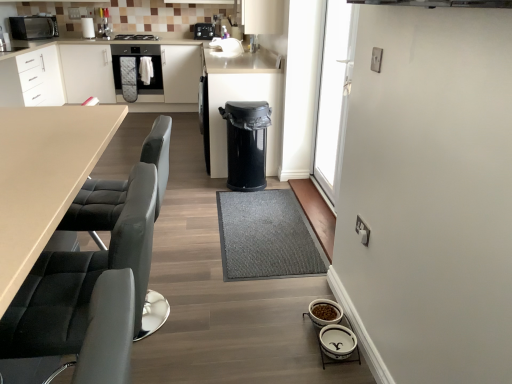
You are a GUI agent. You are given a task and a screenshot of the screen. Output one action in this format:
    pyautogui.click(x=<x>, y=<y>)
    Task: Click on the vacant area that is situated to the right of black leather swivel chair at left
    
    Given the screenshot: What is the action you would take?
    pyautogui.click(x=221, y=313)